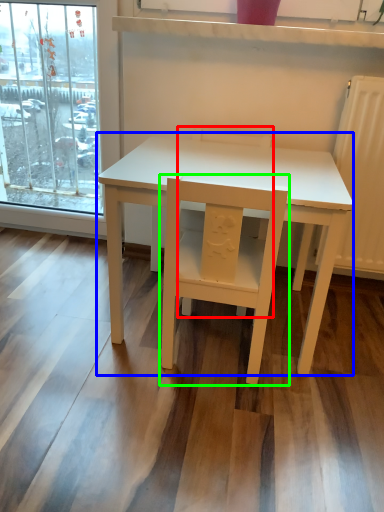
Question: Considering the real-world distances, which object is closest to chair (highlighted by a red box)? table (highlighted by a blue box) or chair (highlighted by a green box).

Choices:
 (A) table
 (B) chair

Answer: (A)